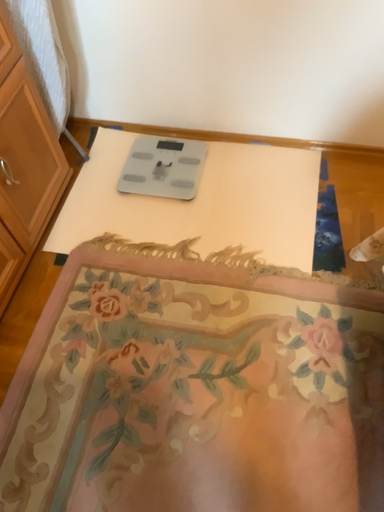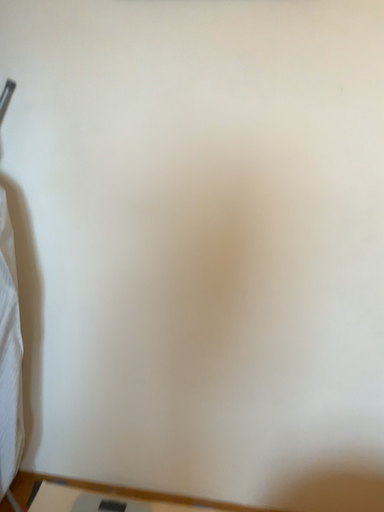
Question: How did the camera likely rotate when shooting the video?

Choices:
 (A) rotated upward
 (B) rotated downward

Answer: (A)